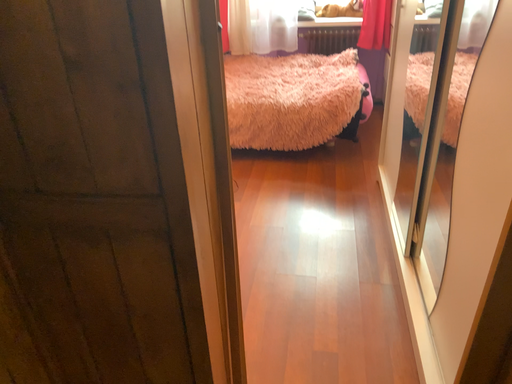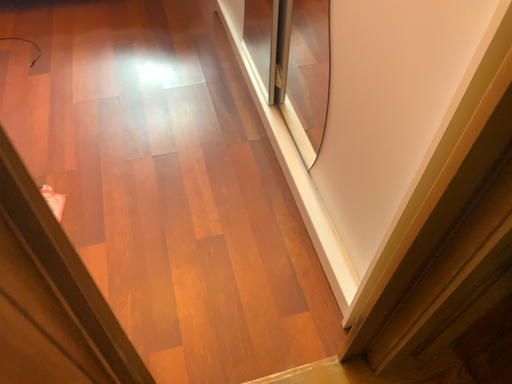
Question: How did the camera likely rotate when shooting the video?

Choices:
 (A) rotated upward
 (B) rotated downward

Answer: (B)